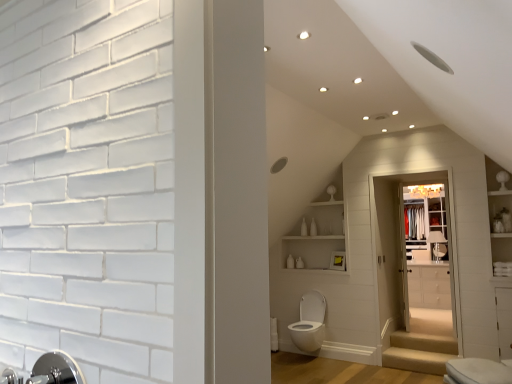
Question: Is white glossy shelves at upper center inside the boundaries of beige fabric stair at lower right, marked as the second stairwell in a top-to-bottom arrangement, or outside?

Choices:
 (A) inside
 (B) outside

Answer: (B)

Question: From the image's perspective, is white glossy shelves at upper center above or below beige fabric stair at lower right, marked as the 1th stairwell in a bottom-to-top arrangement?

Choices:
 (A) below
 (B) above

Answer: (B)

Question: Estimate the real-world distances between objects in this image. Which object is closer to the white glossy toilet at lower center, which is the first toilet in left-to-right order?

Choices:
 (A) white glossy toilet at lower right, marked as the first toilet in a right-to-left arrangement
 (B) beige carpeted stairs at lower center, which appears as the 1th stairwell when viewed from the top
 (C) white glossy cabinet at center
 (D) beige fabric stair at lower right, marked as the second stairwell in a top-to-bottom arrangement
 (E) white glossy medicine cabinet at upper center

Answer: (D)

Question: Estimate the real-world distances between objects in this image. Which object is farther from the white glossy toilet at lower center, which is the first toilet in left-to-right order?

Choices:
 (A) silver metallic faucet at lower left
 (B) white glossy medicine cabinet at upper center
 (C) beige carpeted stairs at lower center, which appears as the 1th stairwell when viewed from the top
 (D) white glossy cabinet at center
 (E) clear glass closet door at center

Answer: (A)